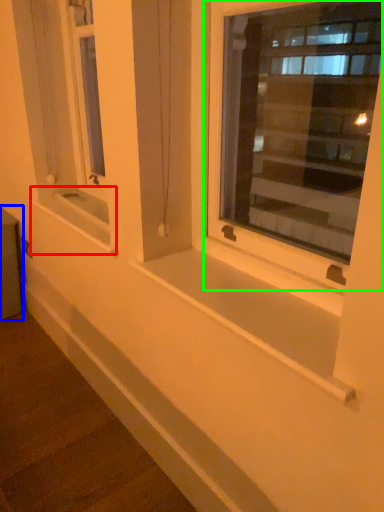
Question: Estimate the real-world distances between objects in this image. Which object is closer to window sill (highlighted by a red box), window box (highlighted by a blue box) or window (highlighted by a green box)?

Choices:
 (A) window box
 (B) window

Answer: (A)